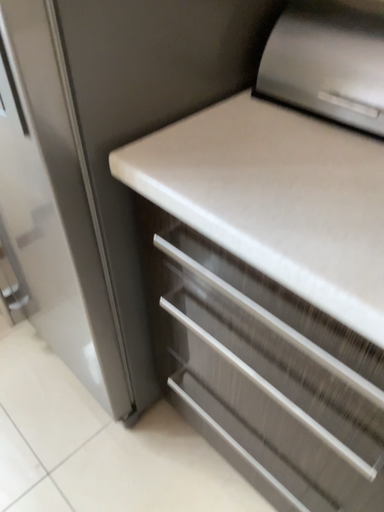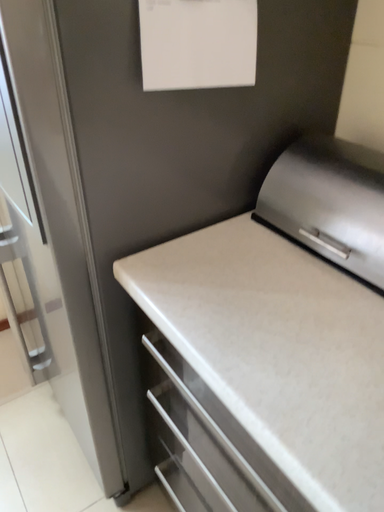
Question: Which way did the camera rotate in the video?

Choices:
 (A) rotated downward
 (B) rotated upward

Answer: (B)